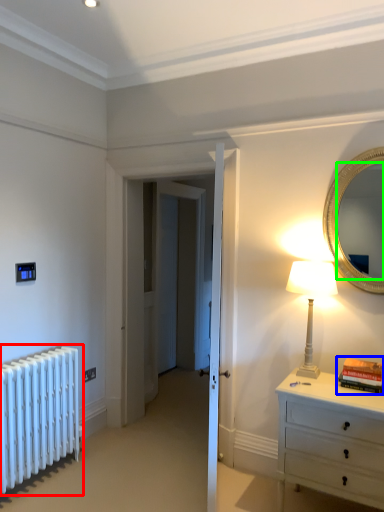
Question: Which object is positioned closest to radiator (highlighted by a red box)? Select from book (highlighted by a blue box) and mirror (highlighted by a green box).

Choices:
 (A) book
 (B) mirror

Answer: (A)